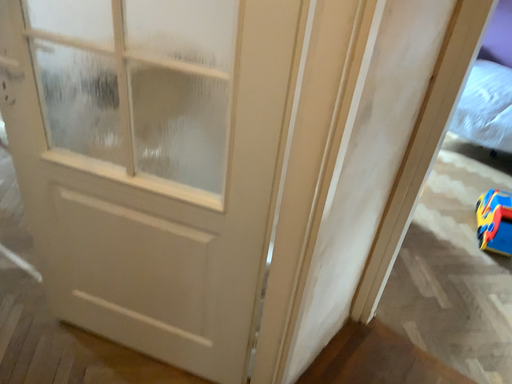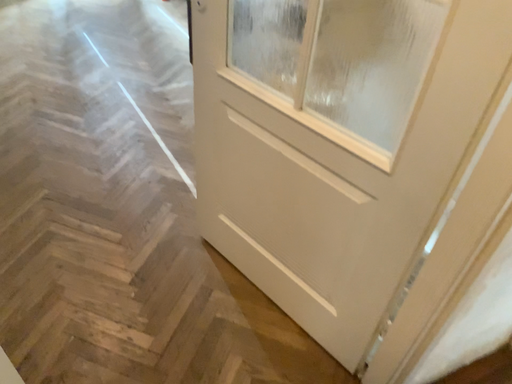
Question: Which way did the camera rotate in the video?

Choices:
 (A) rotated left
 (B) rotated right

Answer: (A)